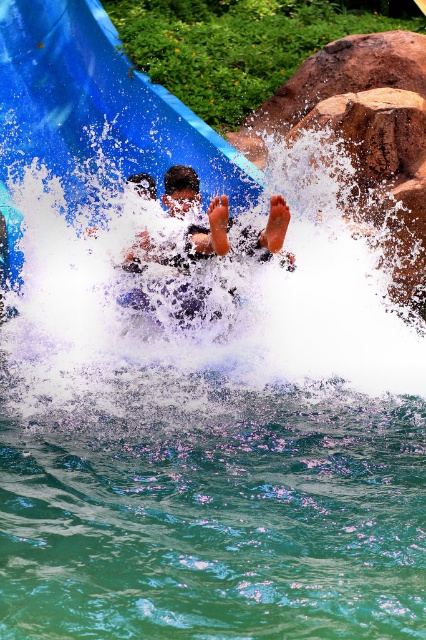
In the scene shown: Is blue plastic slide at upper left closer to the viewer compared to smooth skin person at center?

No, it is behind smooth skin person at center.

Does point (5, 97) come closer to viewer compared to point (282, 225)?

No.

The width and height of the screenshot is (426, 640). Describe the element at coordinates (94, 115) in the screenshot. I see `blue plastic slide at upper left` at that location.

Identify the location of blue plastic slide at upper left. (94, 115).